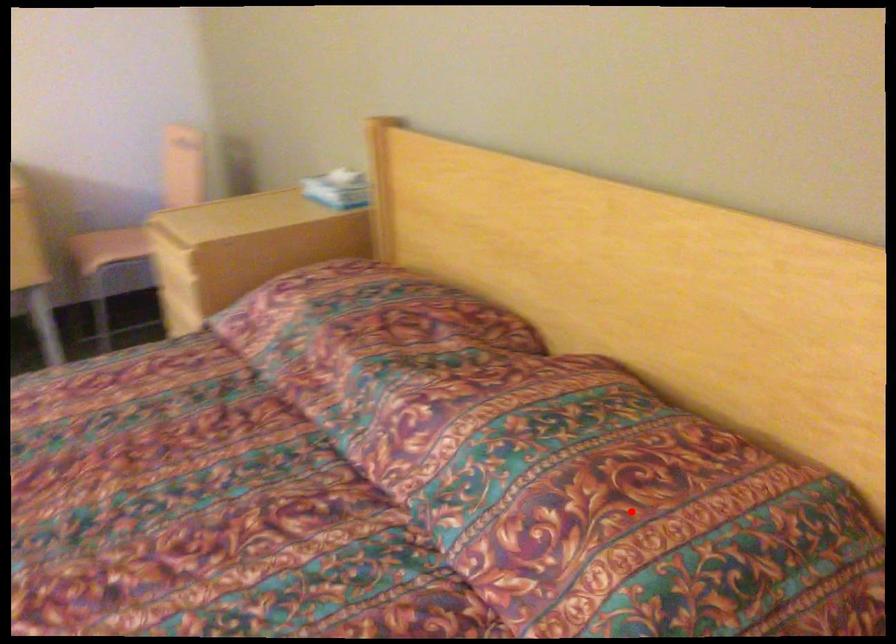
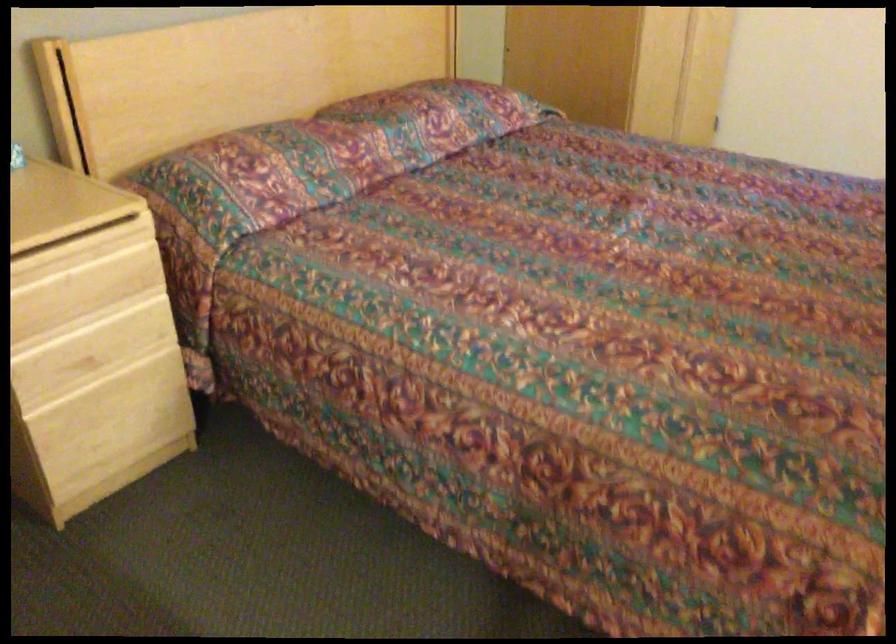
Question: I am providing you with two images of the same scene from different viewpoints. A red point is marked on the first image. Can you still see the location of the red point in image 2?

Choices:
 (A) Yes
 (B) No

Answer: (B)